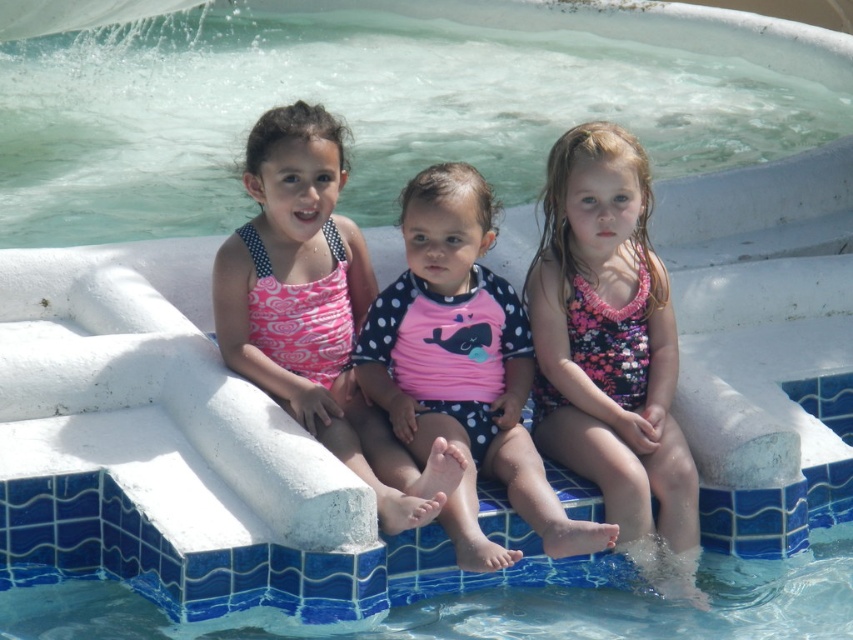
Is pink floral swimsuit at center wider than pink polka dot swimsuit at left?

Indeed, pink floral swimsuit at center has a greater width compared to pink polka dot swimsuit at left.

Does point (555, 298) come behind point (288, 144)?

Yes, it is.

Identify the location of pink floral swimsuit at center. This screenshot has width=853, height=640. (611, 352).

Is point (509, 552) less distant than point (323, 326)?

Yes.

Can you confirm if pink polka dot swimsuit at center is taller than pink polka dot swimsuit at left?

Yes.

Locate an element on the screen. pink polka dot swimsuit at center is located at coordinates (462, 365).

Image resolution: width=853 pixels, height=640 pixels. Find the location of `pink polka dot swimsuit at center`. pink polka dot swimsuit at center is located at coordinates [x=462, y=365].

Is point (642, 570) positioned before point (469, 420)?

Yes, it is.

Is pink floral swimsuit at center thinner than pink polka dot swimsuit at center?

Yes, pink floral swimsuit at center is thinner than pink polka dot swimsuit at center.

Who is more forward, (697, 493) or (393, 404)?

Positioned in front is point (697, 493).

This screenshot has width=853, height=640. Find the location of `pink floral swimsuit at center`. pink floral swimsuit at center is located at coordinates 611,352.